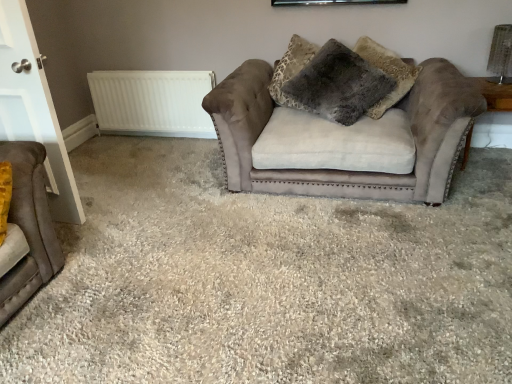
I want to click on unoccupied region to the right of white glossy door at left, so click(108, 224).